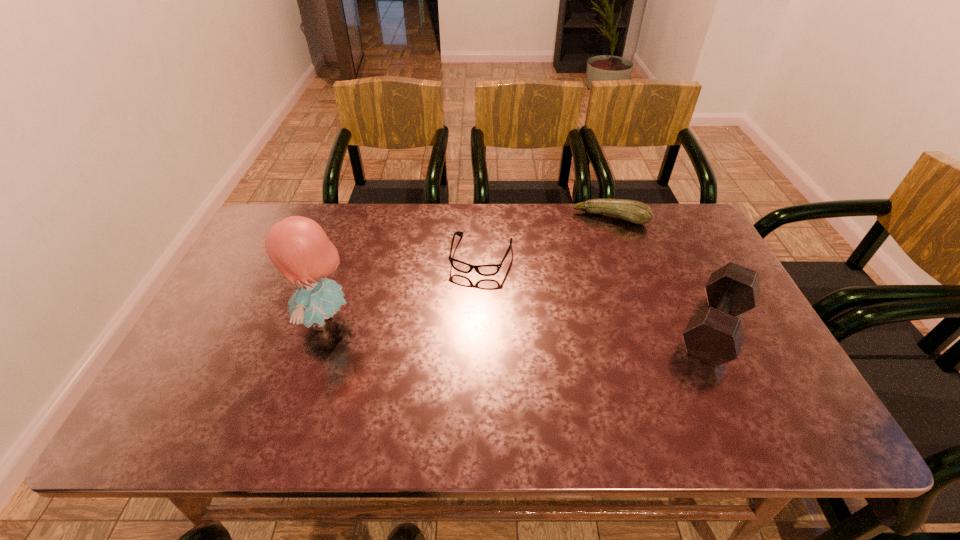
Find the location of `vacant point located between the second object from left to right and the doll`. vacant point located between the second object from left to right and the doll is located at coordinates (403, 288).

Identify the location of free space between the dumbbell and the zucchini. The width and height of the screenshot is (960, 540). (662, 273).

Find the location of a particular element. This screenshot has height=540, width=960. vacant point located between the zucchini and the third object from right to left is located at coordinates (546, 237).

Where is `free space that is in between the farthest object and the third object from right to left`? This screenshot has width=960, height=540. free space that is in between the farthest object and the third object from right to left is located at coordinates (546, 237).

Where is `free spot between the tallest object and the dumbbell`? This screenshot has width=960, height=540. free spot between the tallest object and the dumbbell is located at coordinates (520, 324).

Where is `vacant region between the third nearest object and the third shortest object`? The image size is (960, 540). vacant region between the third nearest object and the third shortest object is located at coordinates (598, 292).

Where is `vacant region between the dumbbell and the spectacles`? The width and height of the screenshot is (960, 540). vacant region between the dumbbell and the spectacles is located at coordinates (598, 292).

Locate an element on the screen. The image size is (960, 540). object that stands as the closest to the leftmost object is located at coordinates (485, 270).

Locate which object is the third closest to the farthest object. Please provide its 2D coordinates. Your answer should be formatted as a tuple, i.e. [(x, y)], where the tuple contains the x and y coordinates of a point satisfying the conditions above.

[(299, 248)]

Locate an element on the screen. vacant position in the image that satisfies the following two spatial constraints: 1. on the back side of the shortest object; 2. on the right side of the zucchini is located at coordinates (481, 218).